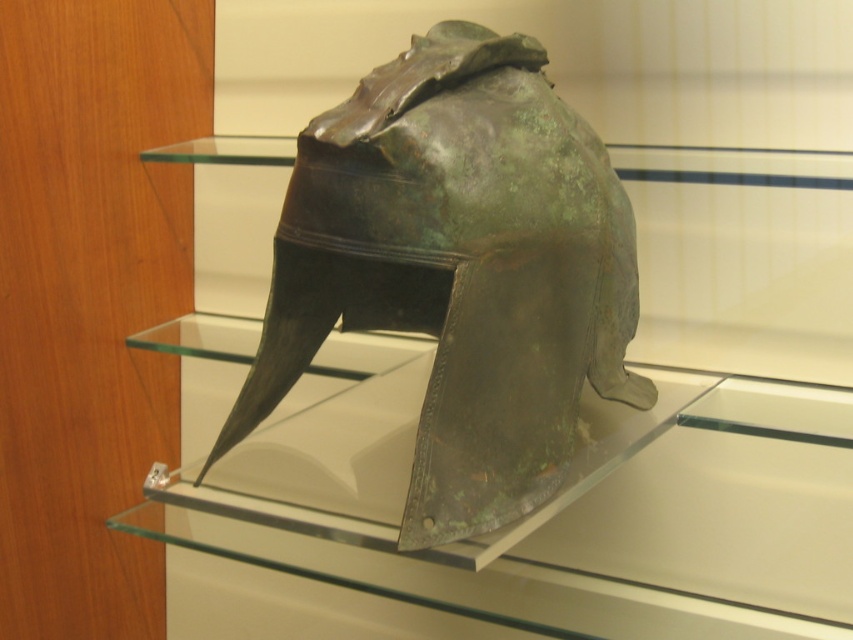
You are a museum visitor who wants to take a photo of both the transparent glass helmet at center and the green patina helmet at center. Since you can only focus on one object at a time, which one should you aim your camera at first to ensure the other is still in frame?

The transparent glass helmet at center is to the left of green patina helmet at center, so you should aim your camera at the transparent glass helmet at center first. This way, the green patina helmet at center will remain in the frame to the right.

You are a museum curator trying to place a new artifact on a shelf. The shelf has a width limit of 30 cm. You have two helmets to choose from in the image. Which helmet, the transparent glass helmet at center or the green patina helmet at center, is more likely to fit on the shelf based on their widths?

The transparent glass helmet at center might be wider than green patina helmet at center, so the green patina helmet at center is more likely to fit on the 30 cm wide shelf.

Based on the scene description, where is the transparent glass helmet at center located in the image?

The transparent glass helmet at center is located at point [579,458].